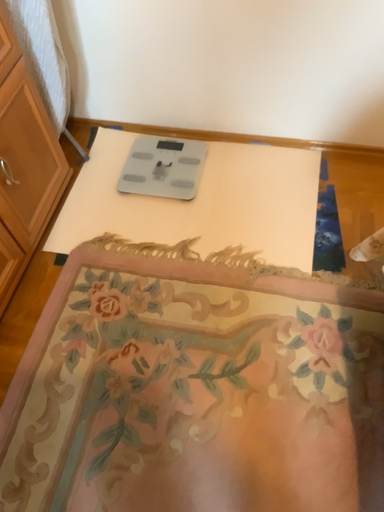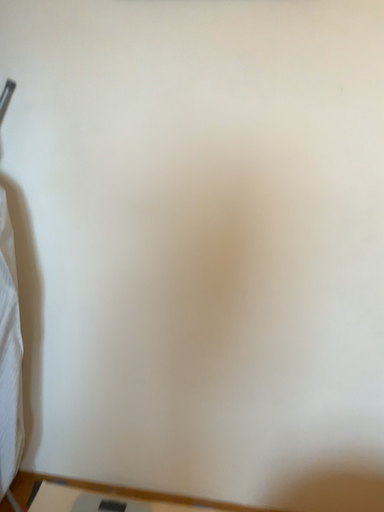
Question: Which way did the camera rotate in the video?

Choices:
 (A) rotated left
 (B) rotated right

Answer: (B)